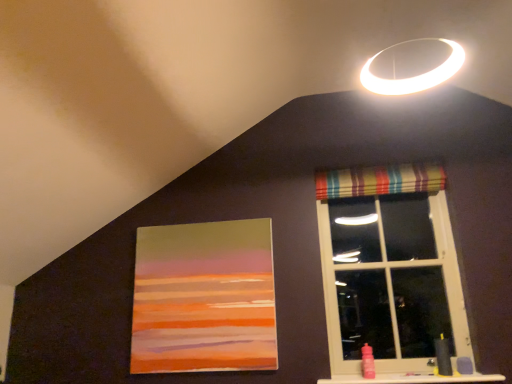
Question: Is striped fabric curtain at upper right wider than striped fabric window at upper right?

Choices:
 (A) no
 (B) yes

Answer: (A)

Question: Can you confirm if striped fabric curtain at upper right is thinner than striped fabric window at upper right?

Choices:
 (A) yes
 (B) no

Answer: (A)

Question: Is striped fabric curtain at upper right not near striped fabric window at upper right?

Choices:
 (A) no
 (B) yes

Answer: (A)

Question: Is striped fabric curtain at upper right with striped fabric window at upper right?

Choices:
 (A) no
 (B) yes

Answer: (A)

Question: Does striped fabric curtain at upper right appear on the left side of striped fabric window at upper right?

Choices:
 (A) yes
 (B) no

Answer: (A)

Question: Is striped fabric window at upper right at the back of striped fabric curtain at upper right?

Choices:
 (A) no
 (B) yes

Answer: (B)

Question: Can you confirm if striped fabric window at upper right is smaller than matte acrylic painting at center?

Choices:
 (A) yes
 (B) no

Answer: (B)

Question: Is striped fabric window at upper right completely or partially outside of matte acrylic painting at center?

Choices:
 (A) no
 (B) yes

Answer: (B)

Question: Is striped fabric window at upper right further to camera compared to matte acrylic painting at center?

Choices:
 (A) yes
 (B) no

Answer: (B)

Question: Is striped fabric window at upper right shorter than matte acrylic painting at center?

Choices:
 (A) no
 (B) yes

Answer: (A)

Question: From a real-world perspective, is striped fabric window at upper right on matte acrylic painting at center?

Choices:
 (A) yes
 (B) no

Answer: (A)

Question: From a real-world perspective, is striped fabric window at upper right under matte acrylic painting at center?

Choices:
 (A) no
 (B) yes

Answer: (A)

Question: Does matte acrylic painting at center turn towards yellow rubber sink at lower right?

Choices:
 (A) yes
 (B) no

Answer: (B)